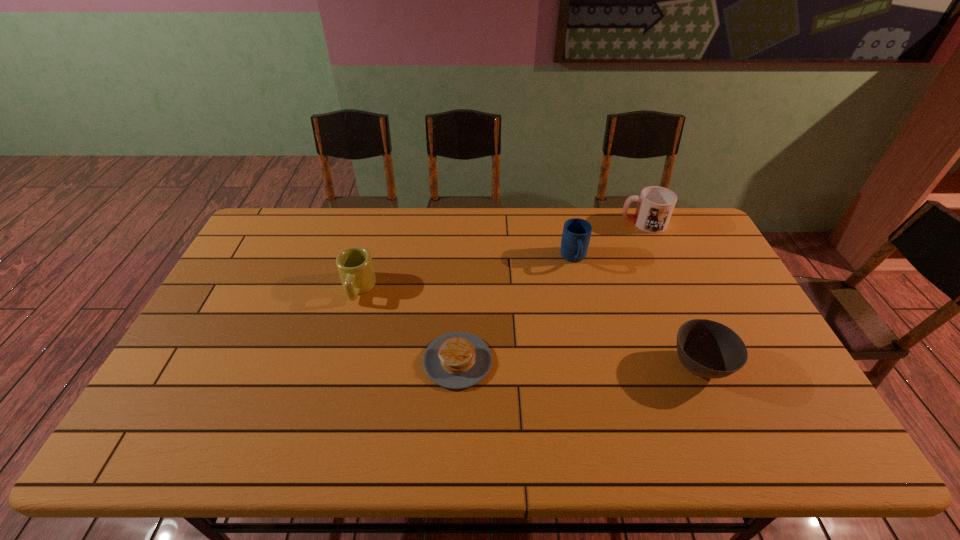
In order to click on vacant space located on the side of the second mug from right to left with the handle in this screenshot , I will do `click(582, 296)`.

The width and height of the screenshot is (960, 540). Identify the location of free spot located with the handle on the side of the leftmost mug. (347, 332).

You are a GUI agent. You are given a task and a screenshot of the screen. Output one action in this format:
    pyautogui.click(x=<x>, y=<y>)
    Task: Click on the free space located 0.070m on the back of the bowl
    
    Given the screenshot: What is the action you would take?
    pyautogui.click(x=681, y=322)

Where is `free region located 0.320m on the back of the shortest object`? The height and width of the screenshot is (540, 960). free region located 0.320m on the back of the shortest object is located at coordinates (462, 259).

Locate an element on the screen. mug situated at the right edge is located at coordinates (655, 205).

Identify the location of bowl at the right edge. (708, 349).

Where is `object that is at the far right corner`? The height and width of the screenshot is (540, 960). object that is at the far right corner is located at coordinates (655, 205).

You are a GUI agent. You are given a task and a screenshot of the screen. Output one action in this format:
    pyautogui.click(x=<x>, y=<y>)
    Task: Click on the vacant space at the far edge of the desktop
    The width and height of the screenshot is (960, 540).
    Given the screenshot: What is the action you would take?
    pyautogui.click(x=491, y=224)

The image size is (960, 540). I want to click on vacant space at the left edge, so click(214, 350).

You are a GUI agent. You are given a task and a screenshot of the screen. Output one action in this format:
    pyautogui.click(x=<x>, y=<y>)
    Task: Click on the vacant space at the far left corner of the desktop
    
    Given the screenshot: What is the action you would take?
    pyautogui.click(x=271, y=222)